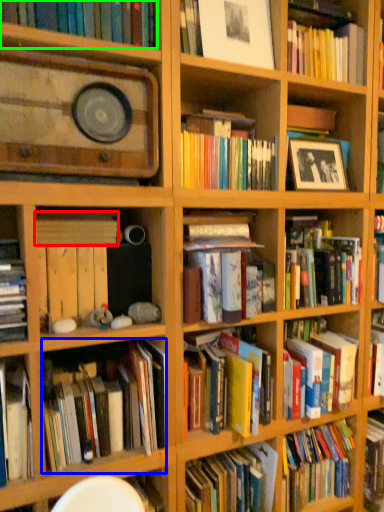
Question: Based on their relative distances, which object is nearer to book (highlighted by a red box)? Choose from book (highlighted by a blue box) and book (highlighted by a green box).

Choices:
 (A) book
 (B) book

Answer: (A)